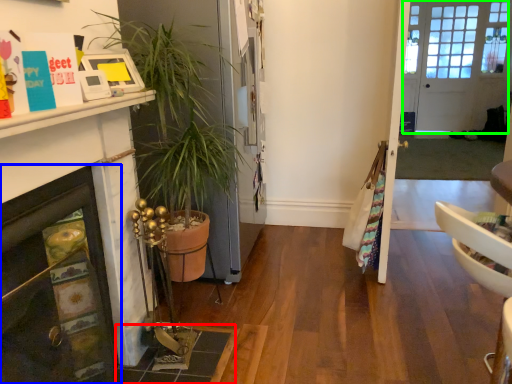
Question: Considering the real-world distances, which object is closest to tile (highlighted by a red box)? fireplace (highlighted by a blue box) or door (highlighted by a green box).

Choices:
 (A) fireplace
 (B) door

Answer: (A)